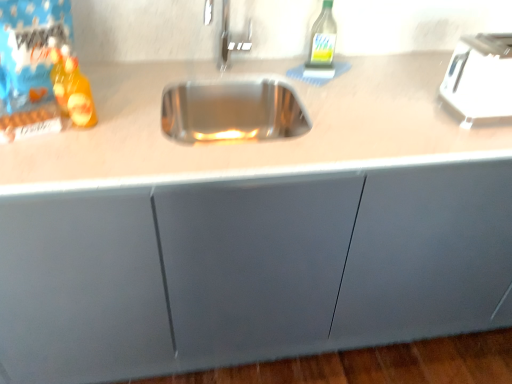
You are a GUI agent. You are given a task and a screenshot of the screen. Output one action in this format:
    pyautogui.click(x=<x>, y=<y>)
    Task: Click on the free location in front of translucent plastic bottle at left, which is the second bottle in top-to-bottom order
    This screenshot has width=512, height=384.
    Given the screenshot: What is the action you would take?
    pyautogui.click(x=64, y=157)